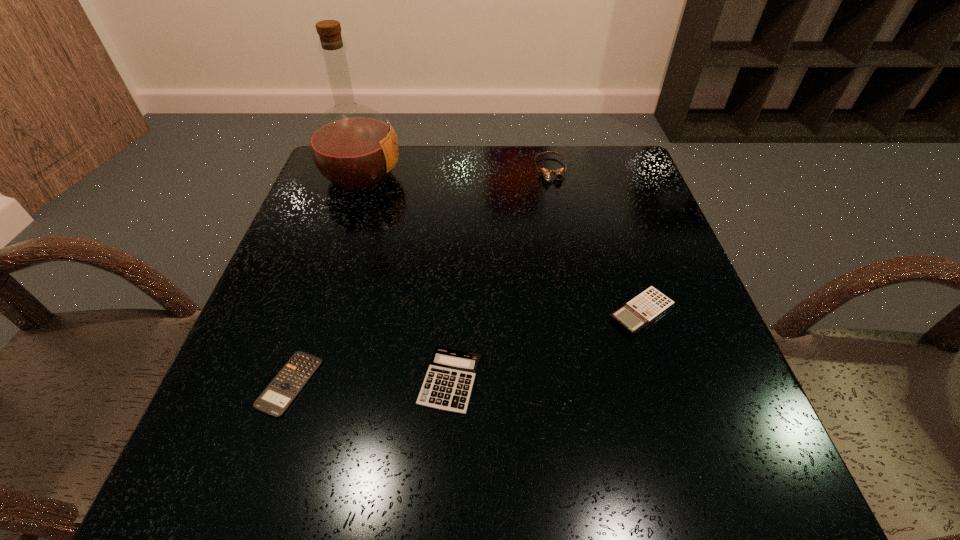
This screenshot has width=960, height=540. Find the location of `free space between the second calculator from left to right and the tallest object`. free space between the second calculator from left to right and the tallest object is located at coordinates (405, 278).

In order to click on free spot between the leftmost calculator and the rightmost object in this screenshot , I will do `click(466, 348)`.

Find the location of `free space between the leftmost calculator and the second calculator from right to left`. free space between the leftmost calculator and the second calculator from right to left is located at coordinates (370, 382).

Where is `free space between the goggles and the liquor`? free space between the goggles and the liquor is located at coordinates (456, 173).

Locate an element on the screen. Image resolution: width=960 pixels, height=540 pixels. empty space that is in between the goggles and the farthest calculator is located at coordinates (596, 241).

Where is `empty space that is in between the rightmost object and the second calculator from right to left`? The width and height of the screenshot is (960, 540). empty space that is in between the rightmost object and the second calculator from right to left is located at coordinates (545, 347).

I want to click on the fourth closest object relative to the rightmost calculator, so coord(353,146).

The height and width of the screenshot is (540, 960). What are the coordinates of `the closest object to the goggles` in the screenshot? It's located at (353, 146).

Where is `calculator identified as the closest to the third object from right to left`? calculator identified as the closest to the third object from right to left is located at coordinates tap(280, 393).

This screenshot has height=540, width=960. I want to click on the closest calculator relative to the third object from right to left, so click(x=280, y=393).